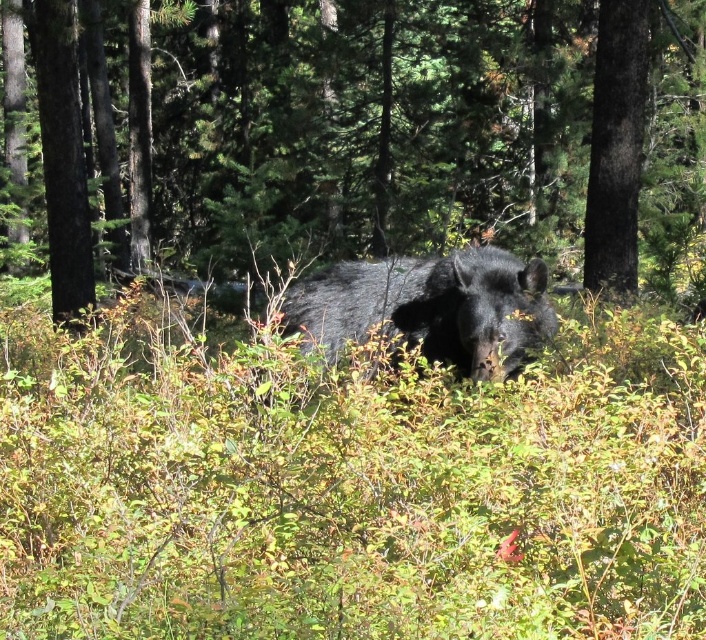
Question: Can you confirm if brown textured tree trunk at center is smaller than shiny black bear at center?

Choices:
 (A) no
 (B) yes

Answer: (A)

Question: Is brown textured tree trunk at center below shiny black bear at center?

Choices:
 (A) yes
 (B) no

Answer: (B)

Question: Which object appears closest to the camera in this image?

Choices:
 (A) brown textured tree trunk at center
 (B) smooth dark brown tree trunk at right

Answer: (B)

Question: Which of the following is the closest to the observer?

Choices:
 (A) (602, 102)
 (B) (671, 218)

Answer: (A)

Question: Which object is farther from the camera taking this photo?

Choices:
 (A) smooth dark brown tree trunk at right
 (B) brown textured tree trunk at center

Answer: (B)

Question: Observing the image, what is the correct spatial positioning of shiny black bear at center in reference to smooth dark brown tree trunk at right?

Choices:
 (A) below
 (B) above

Answer: (A)